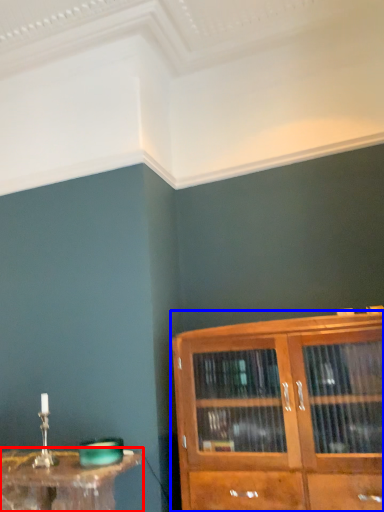
Question: Which object is closer to the camera taking this photo, table (highlighted by a red box) or cupboard (highlighted by a blue box)?

Choices:
 (A) table
 (B) cupboard

Answer: (B)